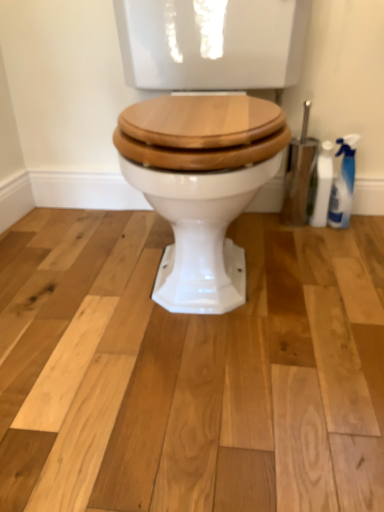
Question: Considering the positions of point (339, 208) and point (331, 159), is point (339, 208) closer or farther from the camera than point (331, 159)?

Choices:
 (A) farther
 (B) closer

Answer: (A)

Question: In terms of size, does translucent plastic spray bottle at right, arranged as the 1th cleaning product when viewed from the right, appear bigger or smaller than white plastic spray bottle at right, arranged as the 1th cleaning product when viewed from the left?

Choices:
 (A) small
 (B) big

Answer: (B)

Question: In terms of height, does translucent plastic spray bottle at right, the 2th cleaning product from the left, look taller or shorter compared to white plastic spray bottle at right, which ranks as the second cleaning product in right-to-left order?

Choices:
 (A) tall
 (B) short

Answer: (A)

Question: From the image's perspective, relative to translucent plastic spray bottle at right, arranged as the 1th cleaning product when viewed from the right, is white plastic spray bottle at right, arranged as the 1th cleaning product when viewed from the left, above or below?

Choices:
 (A) above
 (B) below

Answer: (B)

Question: Considering the positions of white plastic spray bottle at right, arranged as the 1th cleaning product when viewed from the left, and translucent plastic spray bottle at right, the 2th cleaning product from the left, in the image, is white plastic spray bottle at right, arranged as the 1th cleaning product when viewed from the left, bigger or smaller than translucent plastic spray bottle at right, the 2th cleaning product from the left,?

Choices:
 (A) small
 (B) big

Answer: (A)

Question: Is white plastic spray bottle at right, arranged as the 1th cleaning product when viewed from the left, in front of or behind translucent plastic spray bottle at right, arranged as the 1th cleaning product when viewed from the right, in the image?

Choices:
 (A) front
 (B) behind

Answer: (B)

Question: Is white plastic spray bottle at right, arranged as the 1th cleaning product when viewed from the left, situated inside translucent plastic spray bottle at right, arranged as the 1th cleaning product when viewed from the right, or outside?

Choices:
 (A) inside
 (B) outside

Answer: (B)